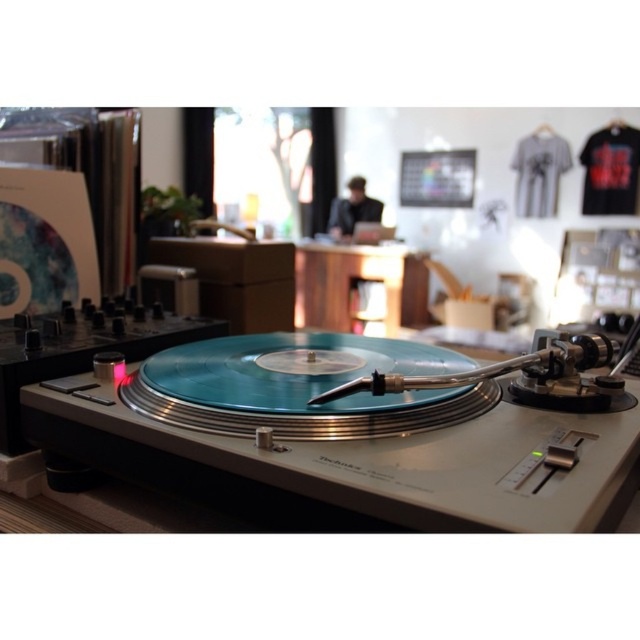
You are setting up a DJ booth and need to place both the wooden table at center and the black fabric dj at center. Based on the image, which object should you place first to ensure there is enough space for both?

The wooden table at center is wider than the black fabric dj at center, so you should place the wooden table at center first to accommodate its larger size.

You are setting up a DJ booth and need to place the teal vinyl record player at center and the black fabric dj at center. According to the image, where should you position the teal vinyl record player relative to the black fabric dj?

The teal vinyl record player at center should be positioned under the black fabric dj at center as shown in the image.

You are a DJ setting up your equipment. You have a teal vinyl record player at center and a wooden table at center. Which object is closer to you?

The teal vinyl record player at center is closer to you because it is in front of the wooden table at center.